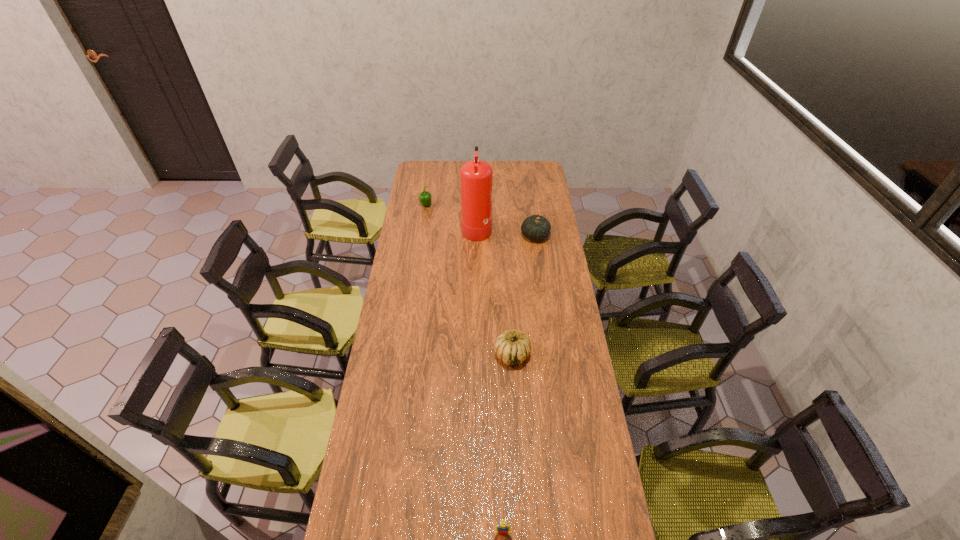
Locate an element on the screen. Image resolution: width=960 pixels, height=540 pixels. vacant space that satisfies the following two spatial constraints: 1. towards the nozzle of the tallest object; 2. on the right side of the rightmost object is located at coordinates (477, 236).

The height and width of the screenshot is (540, 960). What are the coordinates of `vacant space that satisfies the following two spatial constraints: 1. towards the nozzle of the right gourd; 2. on the right side of the fire extinguisher` in the screenshot? It's located at (477, 236).

You are a GUI agent. You are given a task and a screenshot of the screen. Output one action in this format:
    pyautogui.click(x=<x>, y=<y>)
    Task: Click on the vacant space that satisfies the following two spatial constraints: 1. on the front side of the farthest object; 2. on the right side of the rightmost object
    
    Given the screenshot: What is the action you would take?
    pyautogui.click(x=421, y=236)

Where is `free space in the image that satisfies the following two spatial constraints: 1. on the front side of the rightmost object; 2. on the right side of the farthest object`? free space in the image that satisfies the following two spatial constraints: 1. on the front side of the rightmost object; 2. on the right side of the farthest object is located at coordinates (421, 236).

Identify the location of free space that satisfies the following two spatial constraints: 1. towards the nozzle of the tallest object; 2. on the right side of the right gourd. The height and width of the screenshot is (540, 960). (477, 236).